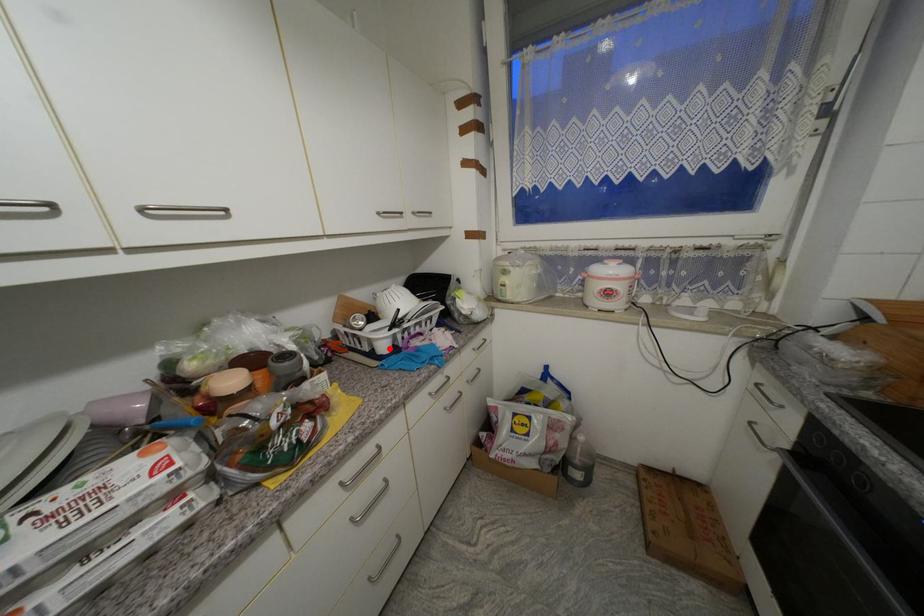
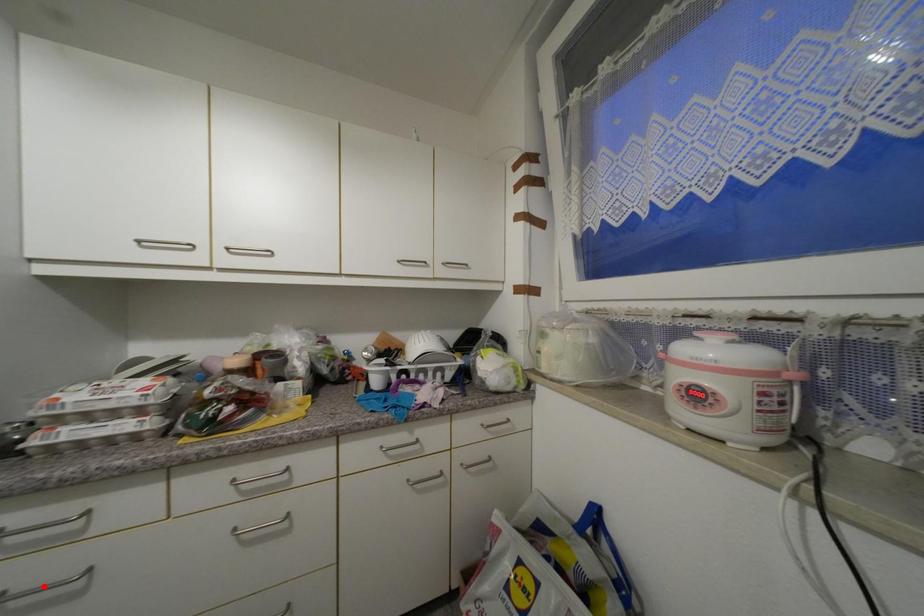
I am providing you with two images of the same scene from different viewpoints. A red point is marked on the first image and another point is marked on the second image. Is the marked point in image1 the same physical position as the marked point in image2?

No